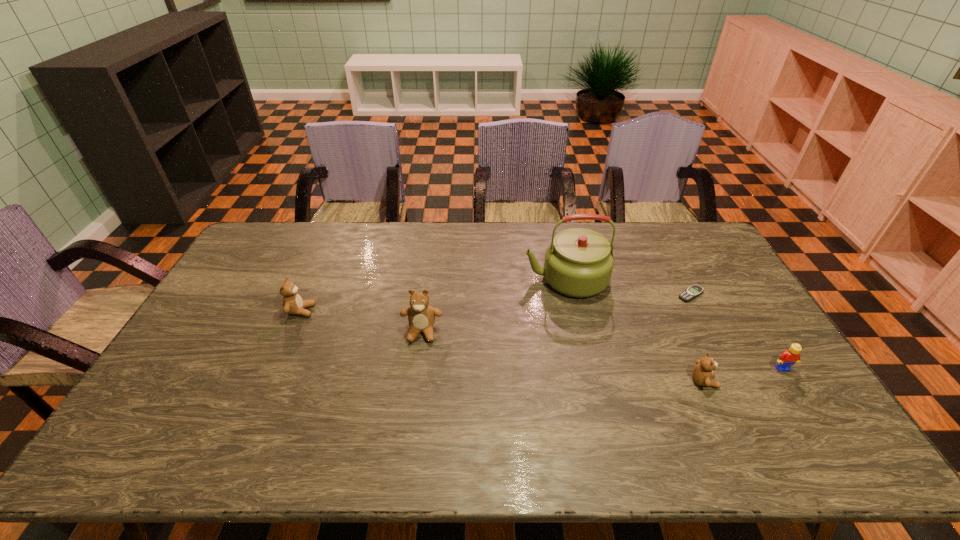
Identify the location of blank space that satisfies the following two spatial constraints: 1. on the back side of the beeper; 2. at the spout of the third object from left to right. The image size is (960, 540). (683, 279).

Locate an element on the screen. free region that satisfies the following two spatial constraints: 1. at the spout of the second object from right to left; 2. on the left side of the third object from left to right is located at coordinates (569, 294).

Find the location of a particular element. free point that satisfies the following two spatial constraints: 1. at the spout of the third object from left to right; 2. on the front-facing side of the fifth object from right to left is located at coordinates (577, 332).